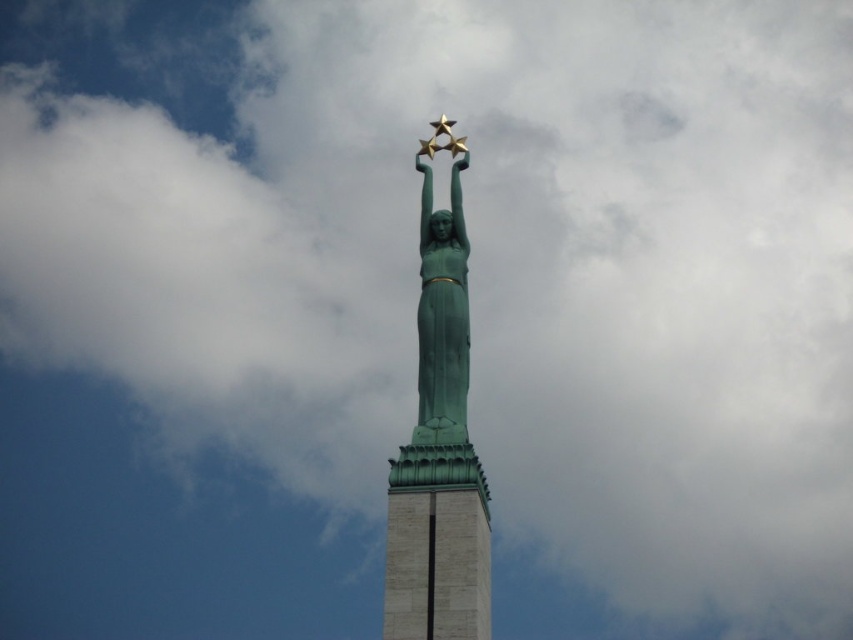
Based on the scene description, can you determine if the green patina statue at center is wider than the green stone tower at center?

The green patina statue at center might be wider than green stone tower at center according to the description.

You are an architect designing a new park layout and need to place a new bench. You want the bench to be positioned so that it faces the green patina statue at center while also having a clear view of the green stone tower at center. Is this possible given their sizes?

The green patina statue at center is much taller than the green stone tower at center. Therefore, the statue might block the view of the tower from certain angles. To ensure a clear view of both, the bench should be placed at a position where the statue and tower are not directly aligned, allowing both to be seen separately.

You are standing at the origin point of the coordinate system in the image. The statue is located at coordinates 0.697, 0.516. If you want to walk directly to the green patina statue at center, in which direction should you move?

You should move towards the coordinates (439, 445), which is the location of the green patina statue at center.